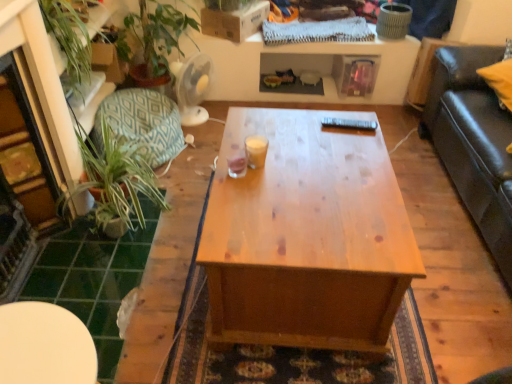
Find the location of a particular element. This screenshot has height=384, width=512. free space to the left of translucent glass cup at center, the 2th coffee cup in the left-to-right sequence is located at coordinates (224, 160).